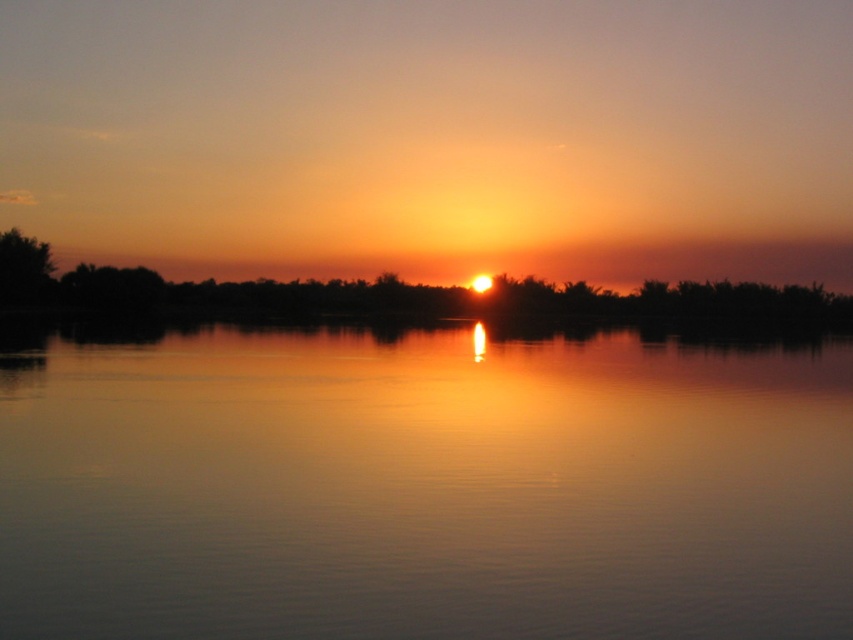
Question: Does glossy water at center lie behind green leafy tree at left?

Choices:
 (A) yes
 (B) no

Answer: (B)

Question: In this image, where is glossy water at center located relative to green leafy tree at left?

Choices:
 (A) left
 (B) right

Answer: (B)

Question: Which point is closer to the camera taking this photo?

Choices:
 (A) (42, 280)
 (B) (590, 500)

Answer: (B)

Question: Is glossy water at center to the left of green leafy tree at left from the viewer's perspective?

Choices:
 (A) no
 (B) yes

Answer: (A)

Question: Among these points, which one is farthest from the camera?

Choices:
 (A) (770, 540)
 (B) (22, 275)

Answer: (B)